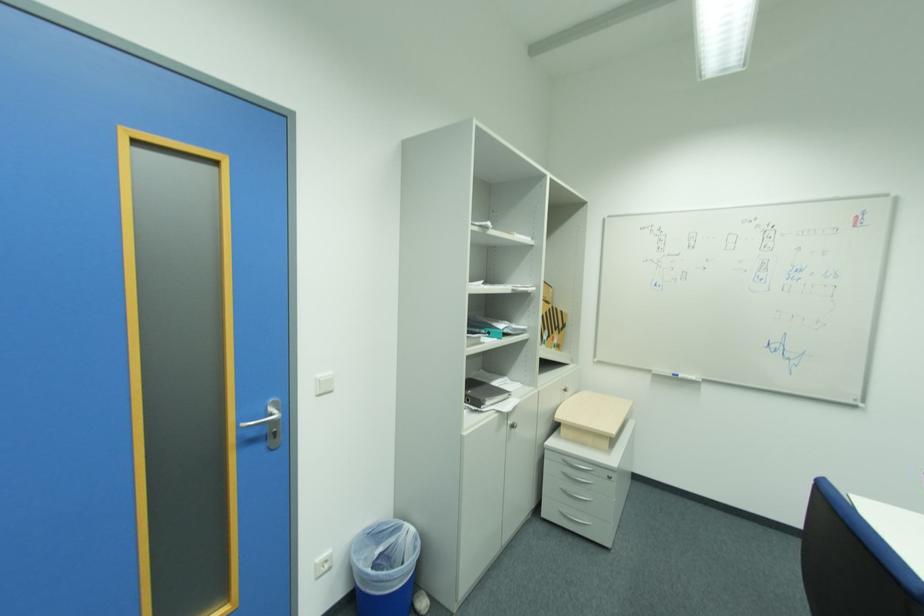
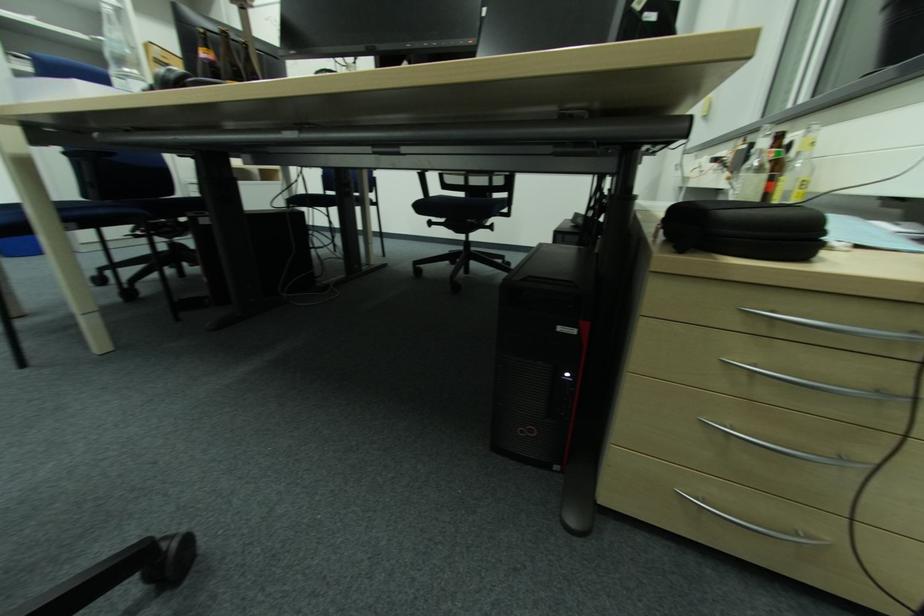
The images are taken continuously from a first-person perspective. In which direction are you moving?

The cameraman moved toward right, backward.